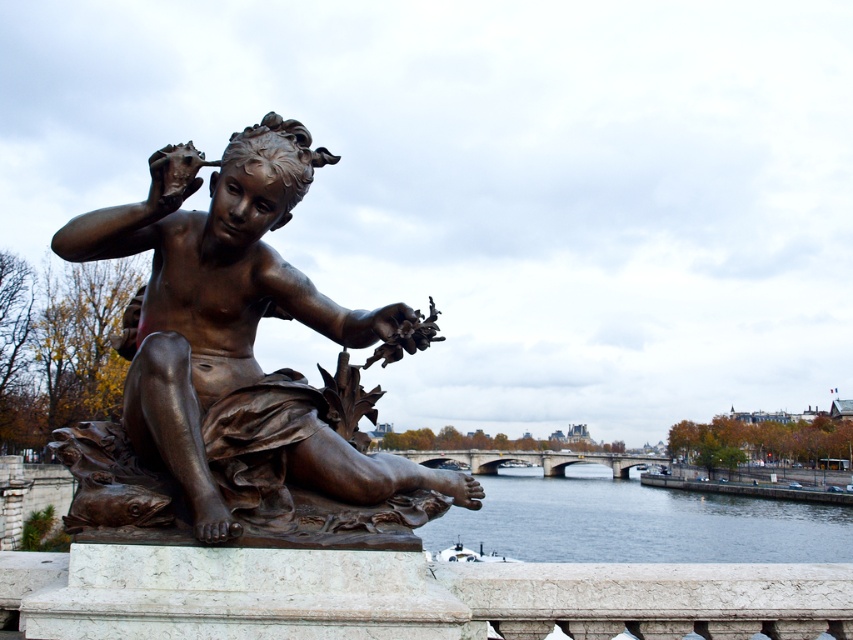
You are a tourist standing in front of the bronze statue at center and the dark blue water at lower center. Which object is located to the right side of the other?

The bronze statue at center is positioned on the left side of dark blue water at lower center, so the dark blue water at lower center is located to the right side of the bronze statue at center.

You are an architect designing a new garden layout. You want to place a bench so that visitors can view both the bronze statue at center and the dark blue water at lower center without obstruction. Based on their relative heights, which object should be positioned closer to the bench to ensure both are visible?

The bronze statue at center is shorter than the dark blue water at lower center. To ensure both are visible without obstruction, position the shorter bronze statue at center closer to the bench so that its view isn